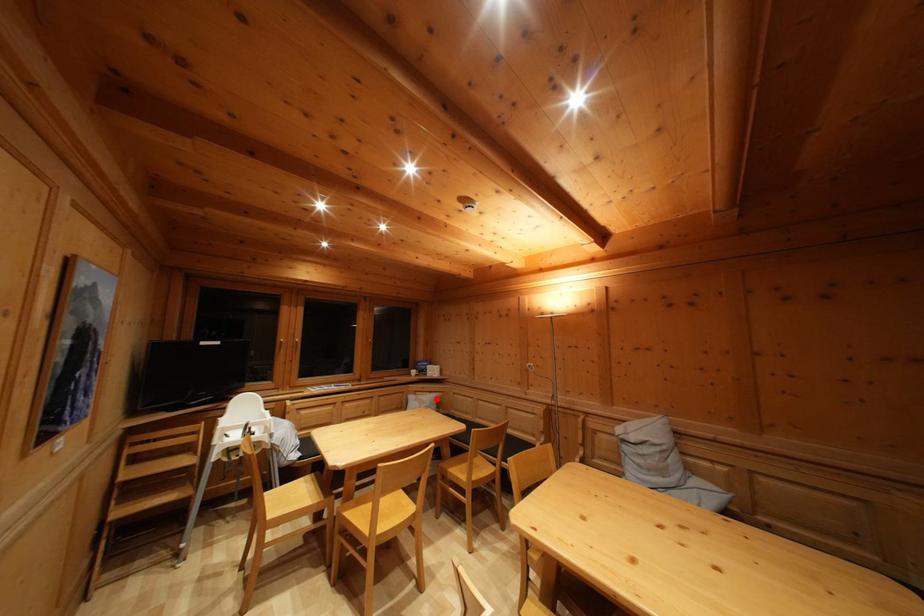
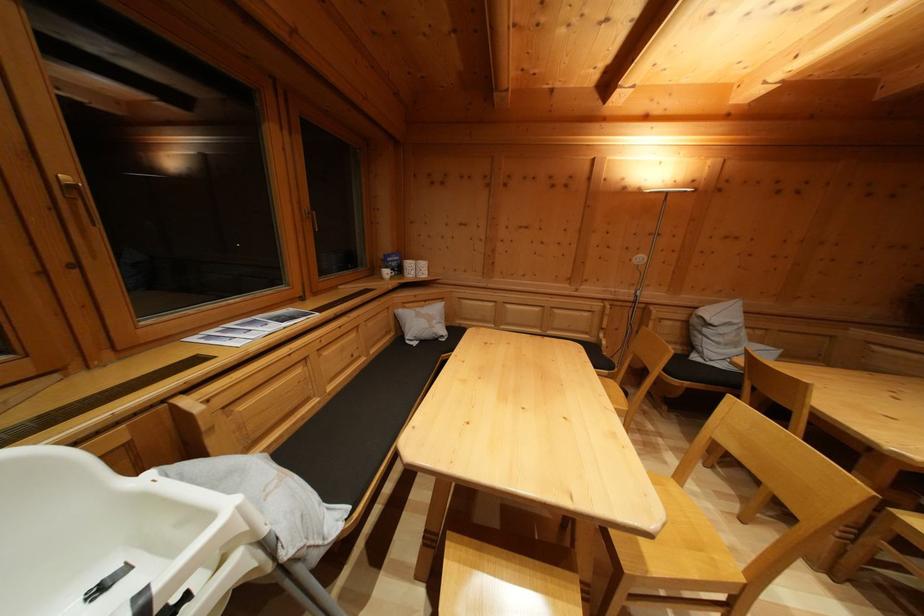
The point at the highlighted location is marked in the first image. Where is the corresponding point in the second image?

(431, 308)